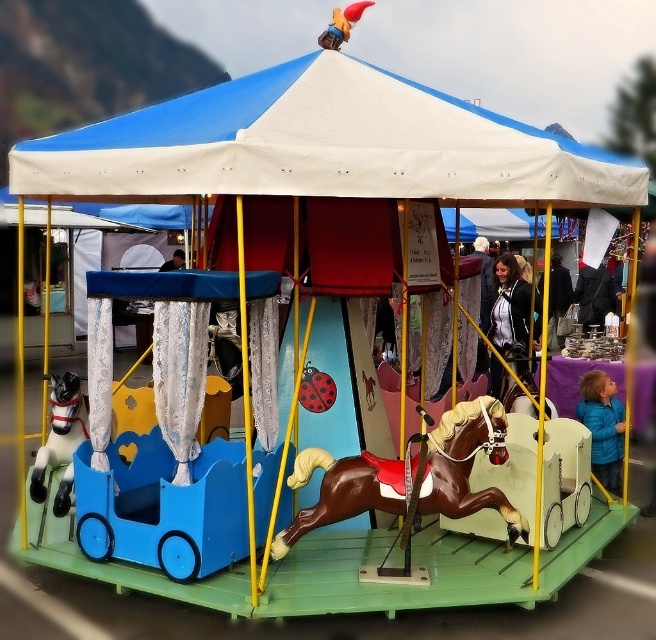
Question: Does brown glossy horse at center have a larger size compared to blue matte jacket at lower right?

Choices:
 (A) yes
 (B) no

Answer: (A)

Question: Is black leather jacket at center closer to camera compared to dark brown hair at center?

Choices:
 (A) no
 (B) yes

Answer: (B)

Question: Among these objects, which one is nearest to the camera?

Choices:
 (A) white fabric canopy at upper center
 (B) white glossy horse at left

Answer: (A)

Question: In this image, where is white fabric canopy at upper center located relative to white glossy horse at left?

Choices:
 (A) above
 (B) below

Answer: (A)

Question: Which point is farther from the camera taking this photo?

Choices:
 (A) (495, 403)
 (B) (567, 296)
 (C) (68, 371)

Answer: (B)

Question: Among these points, which one is farthest from the camera?

Choices:
 (A) (499, 349)
 (B) (174, 262)
 (C) (58, 460)

Answer: (B)